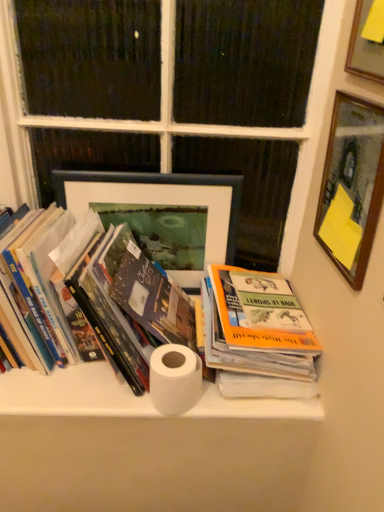
Question: Which direction should I rotate to face matte black picture frame at center, positioned as the 3th picture frame in front-to-back order, — up or down?

Choices:
 (A) up
 (B) down

Answer: (A)

Question: Considering the relative sizes of orange matte book at center, the first book positioned from the right, and matte black picture frame at center, the first picture frame in the left-to-right sequence, in the image provided, is orange matte book at center, the first book positioned from the right, taller than matte black picture frame at center, the first picture frame in the left-to-right sequence,?

Choices:
 (A) no
 (B) yes

Answer: (A)

Question: Can you confirm if orange matte book at center, the first book positioned from the right, is thinner than matte black picture frame at center, the first picture frame in the left-to-right sequence?

Choices:
 (A) yes
 (B) no

Answer: (B)

Question: Does orange matte book at center, which ranks as the second book in left-to-right order, lie behind matte black picture frame at center, positioned as the 3th picture frame in front-to-back order?

Choices:
 (A) no
 (B) yes

Answer: (A)

Question: Does orange matte book at center, the first book positioned from the right, have a greater width compared to matte black picture frame at center, positioned as the 3th picture frame in front-to-back order?

Choices:
 (A) yes
 (B) no

Answer: (A)

Question: Is the depth of orange matte book at center, the first book positioned from the right, less than that of matte black picture frame at center, which is counted as the first picture frame, starting from the back?

Choices:
 (A) yes
 (B) no

Answer: (A)

Question: Considering the relative sizes of orange matte book at center, which ranks as the second book in left-to-right order, and matte black picture frame at center, the first picture frame in the left-to-right sequence, in the image provided, is orange matte book at center, which ranks as the second book in left-to-right order, smaller than matte black picture frame at center, the first picture frame in the left-to-right sequence,?

Choices:
 (A) no
 (B) yes

Answer: (A)

Question: Considering the relative sizes of white painted wood at upper center and white matte toilet paper at center in the image provided, is white painted wood at upper center smaller than white matte toilet paper at center?

Choices:
 (A) no
 (B) yes

Answer: (A)

Question: From a real-world perspective, does white painted wood at upper center sit lower than white matte toilet paper at center?

Choices:
 (A) yes
 (B) no

Answer: (B)

Question: Is white painted wood at upper center located outside white matte toilet paper at center?

Choices:
 (A) yes
 (B) no

Answer: (A)

Question: Does white painted wood at upper center have a lesser width compared to white matte toilet paper at center?

Choices:
 (A) yes
 (B) no

Answer: (B)

Question: Is white painted wood at upper center closer to camera compared to white matte toilet paper at center?

Choices:
 (A) yes
 (B) no

Answer: (A)

Question: Would you say white painted wood at upper center is a long distance from white matte toilet paper at center?

Choices:
 (A) yes
 (B) no

Answer: (B)

Question: Can you see matte black picture frame at center, positioned as the 3th picture frame in front-to-back order, touching wooden picture frame at upper right, acting as the second picture frame starting from the right?

Choices:
 (A) no
 (B) yes

Answer: (A)